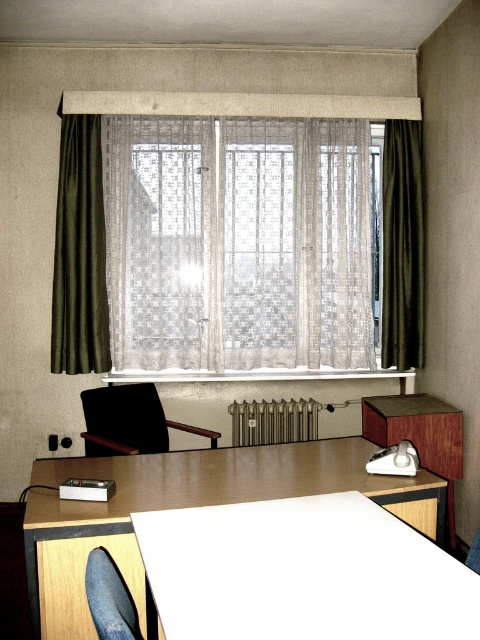
You are organizing a small event and need to place a 1.2 meter long banner on the light brown wooden table at center. The banner must be placed horizontally. Can the banner fit on the table if the dark green fabric curtain at right is currently occupying the right half of the table?

The light brown wooden table at center might be wider than dark green fabric curtain at right, but since the curtain is occupying the right half, there might still be enough space on the left half for the 1.2 meter banner. However, without exact measurements, it is uncertain.

You are organizing a small event in the room and need to place a 1.2 meter long table between the dark green fabric curtain at right and the black wood armchair at left. Will the space between them accommodate the table?

The dark green fabric curtain at right is narrower than the black wood armchair at left, but the exact distance between them isn